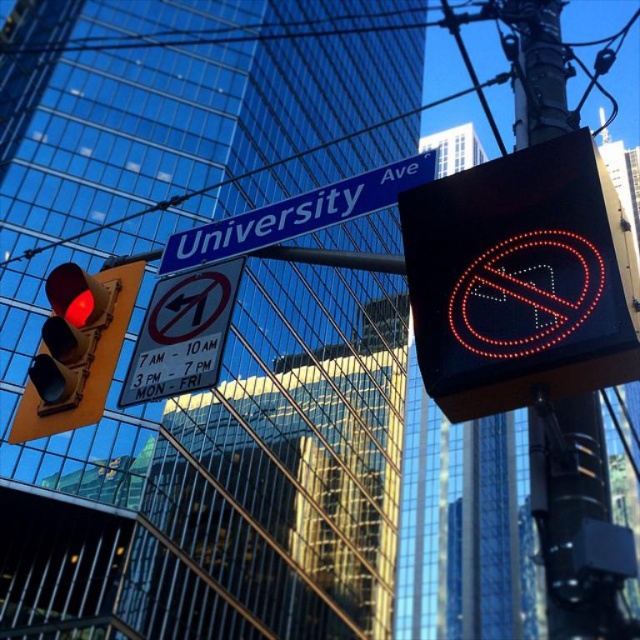
Question: Is blue metallic street sign at upper center wider than transparent glass power line at upper center?

Choices:
 (A) no
 (B) yes

Answer: (A)

Question: Is matte glass traffic light at left wider than blue metallic street sign at upper center?

Choices:
 (A) no
 (B) yes

Answer: (A)

Question: Observing the image, what is the correct spatial positioning of black plastic sign at upper right in reference to matte glass traffic light at left?

Choices:
 (A) right
 (B) left

Answer: (A)

Question: Which point is farther to the camera?

Choices:
 (A) blue metallic street sign at upper center
 (B) black plastic sign at upper right

Answer: (A)

Question: Which point appears farthest from the camera in this image?

Choices:
 (A) (276, 237)
 (B) (504, 13)

Answer: (B)

Question: Which point is closer to the camera taking this photo?

Choices:
 (A) (122, 276)
 (B) (545, 364)

Answer: (B)